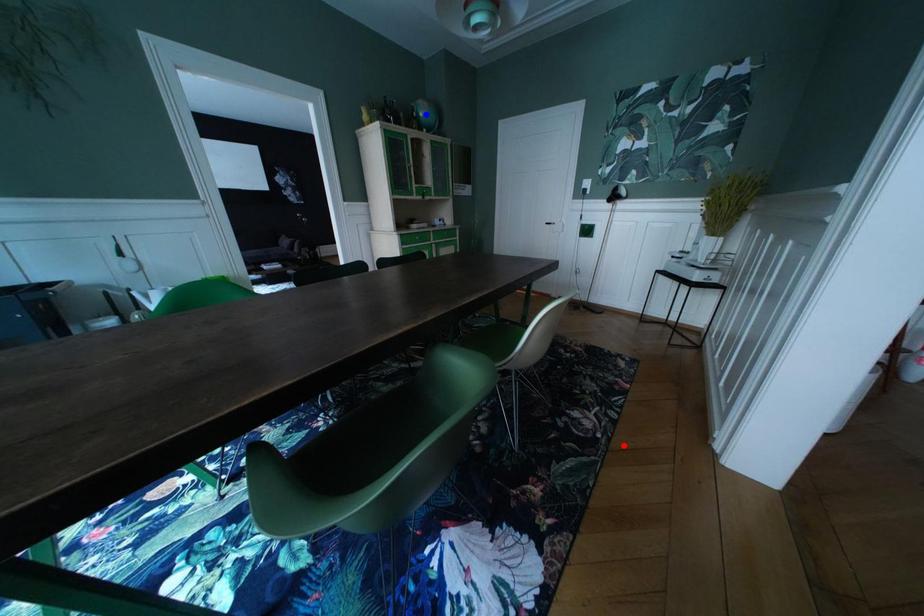
Question: Two points are marked on the image. Which point is closer to the camera?

Choices:
 (A) Blue point is closer.
 (B) Red point is closer.

Answer: (B)